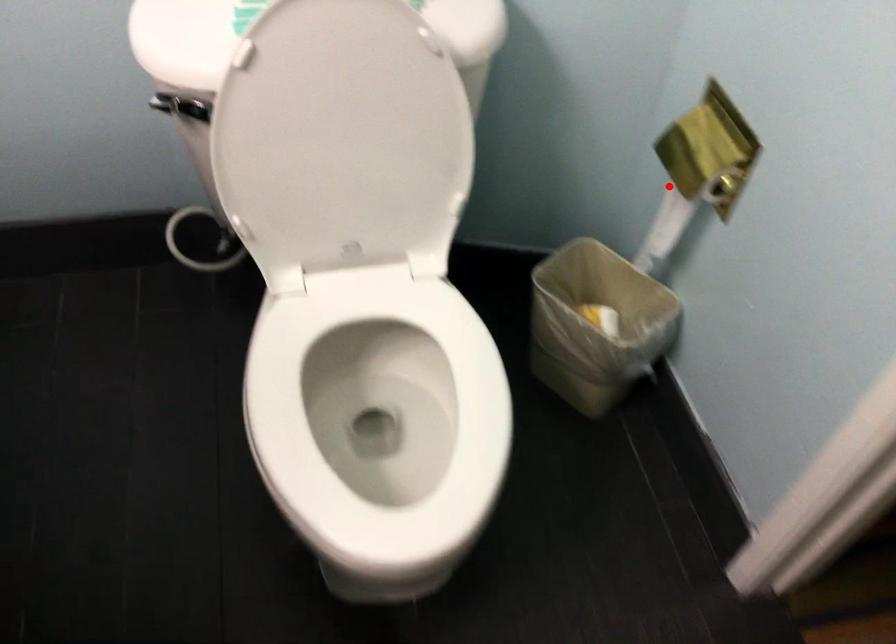
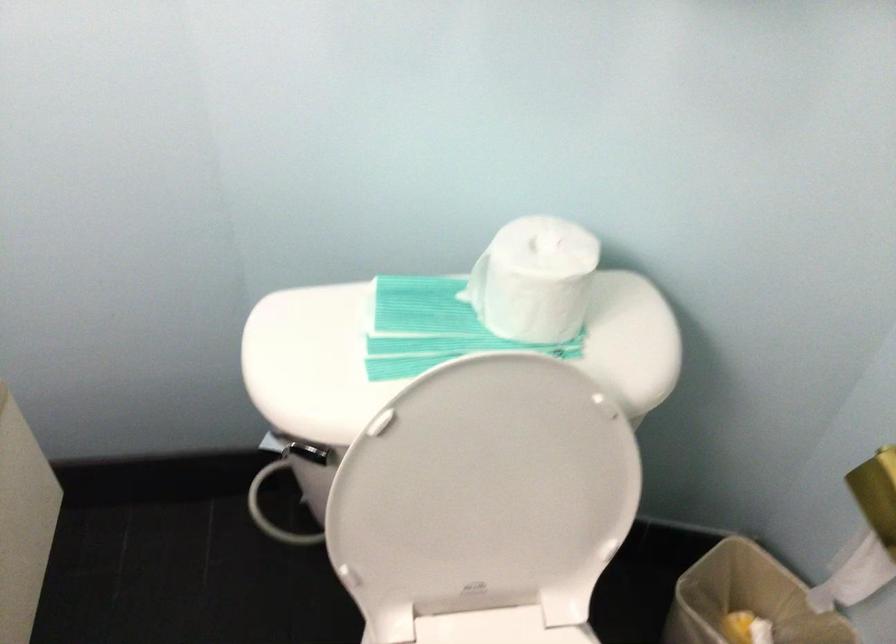
Question: I am providing you with two images of the same scene from different viewpoints. A red point is shown in image1. For the corresponding object point in image2, is it positioned nearer or farther from the camera?

Choices:
 (A) Nearer
 (B) Farther

Answer: (A)